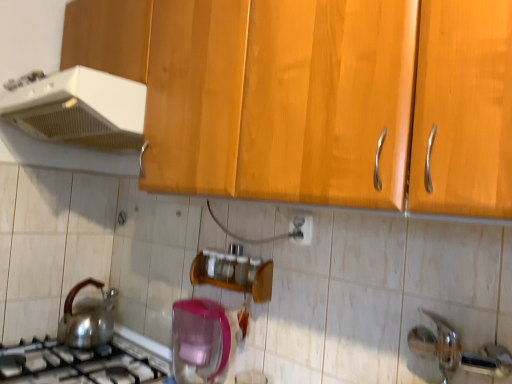
Question: Is satin silver gas stove at lower left beside translucent plastic container at lower center, the third kitchen appliance viewed from the top?

Choices:
 (A) yes
 (B) no

Answer: (B)

Question: Considering the relative positions of satin silver gas stove at lower left and translucent plastic container at lower center, the third kitchen appliance viewed from the top, in the image provided, is satin silver gas stove at lower left in front of translucent plastic container at lower center, the third kitchen appliance viewed from the top,?

Choices:
 (A) yes
 (B) no

Answer: (A)

Question: Is satin silver gas stove at lower left surrounding translucent plastic container at lower center, the third kitchen appliance viewed from the top?

Choices:
 (A) no
 (B) yes

Answer: (A)

Question: Does satin silver gas stove at lower left have a greater height compared to translucent plastic container at lower center, the third kitchen appliance viewed from the top?

Choices:
 (A) no
 (B) yes

Answer: (A)

Question: Considering the relative positions of satin silver gas stove at lower left and translucent plastic container at lower center, which ranks as the first kitchen appliance in bottom-to-top order, in the image provided, is satin silver gas stove at lower left behind translucent plastic container at lower center, which ranks as the first kitchen appliance in bottom-to-top order,?

Choices:
 (A) no
 (B) yes

Answer: (A)

Question: Can you confirm if satin silver gas stove at lower left is shorter than translucent plastic container at lower center, the third kitchen appliance viewed from the top?

Choices:
 (A) no
 (B) yes

Answer: (B)

Question: Does translucent plastic container at lower center, the third kitchen appliance viewed from the top, have a lesser width compared to white plastic range hood at upper left, arranged as the first kitchen appliance when viewed from the top?

Choices:
 (A) no
 (B) yes

Answer: (B)

Question: Is translucent plastic container at lower center, which ranks as the first kitchen appliance in bottom-to-top order, facing towards white plastic range hood at upper left, arranged as the first kitchen appliance when viewed from the top?

Choices:
 (A) yes
 (B) no

Answer: (B)

Question: Is white plastic range hood at upper left, which is counted as the 3th kitchen appliance, starting from the bottom, at the back of translucent plastic container at lower center, the third kitchen appliance viewed from the top?

Choices:
 (A) no
 (B) yes

Answer: (A)

Question: Can you confirm if translucent plastic container at lower center, which ranks as the first kitchen appliance in bottom-to-top order, is bigger than white plastic range hood at upper left, arranged as the first kitchen appliance when viewed from the top?

Choices:
 (A) yes
 (B) no

Answer: (B)

Question: Is translucent plastic container at lower center, the third kitchen appliance viewed from the top, closer to the viewer compared to white plastic range hood at upper left, arranged as the first kitchen appliance when viewed from the top?

Choices:
 (A) no
 (B) yes

Answer: (A)

Question: Is translucent plastic container at lower center, which ranks as the first kitchen appliance in bottom-to-top order, wider than white plastic range hood at upper left, which is counted as the 3th kitchen appliance, starting from the bottom?

Choices:
 (A) no
 (B) yes

Answer: (A)

Question: From the image's perspective, is white glossy electric outlet at center over satin silver gas stove at lower left?

Choices:
 (A) no
 (B) yes

Answer: (B)